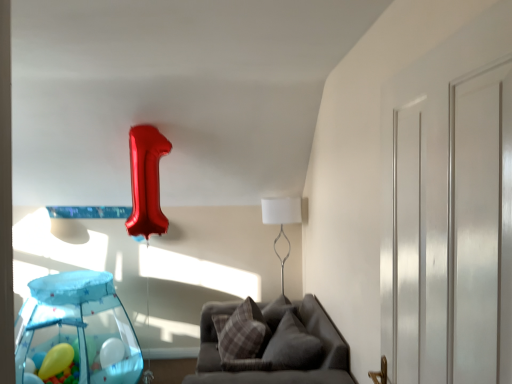
What are the coordinates of `white metallic table lamp at center` in the screenshot? It's located at (281, 222).

Measure the distance between gray fabric couch at lower center and camera.

The depth of gray fabric couch at lower center is 7.43 feet.

Describe the element at coordinates (56, 360) in the screenshot. I see `yellow rubber balloon at lower left` at that location.

What is the approximate width of plush gray pillow at center, acting as the first pillow starting from the right?

14.17 inches.

This screenshot has width=512, height=384. I want to click on white glossy door at right, so click(x=449, y=232).

This screenshot has width=512, height=384. What are the coordinates of `white metallic table lamp at center` in the screenshot? It's located at (281, 222).

Between gray fabric couch at lower center and white glossy door at right, which one has less height?

With less height is gray fabric couch at lower center.

This screenshot has width=512, height=384. I want to click on glass door that appears above the gray fabric couch at lower center (from a real-world perspective), so click(449, 232).

Does point (208, 365) lie in front of point (466, 147)?

No, it is not.

Which is correct: white metallic table lamp at center is inside white glossy door at right, or outside of it?

white metallic table lamp at center is spatially situated outside white glossy door at right.

From a real-world perspective, is white metallic table lamp at center located beneath white glossy door at right?

Correct, in the physical world, white metallic table lamp at center is lower than white glossy door at right.

Are white metallic table lamp at center and white glossy door at right far apart?

Yes.

Is white metallic table lamp at center taller than white glossy door at right?

No.

Between plaid fabric pillow at center, the 1th pillow from the left, and gray fabric couch at lower center, which one has larger size?

Bigger between the two is gray fabric couch at lower center.

From the gray fabric couch at lower center, count 2nd pillows backward and point to it. Please provide its 2D coordinates.

[(243, 333)]

Is plaid fabric pillow at center, the 1th pillow from the left, not within gray fabric couch at lower center?

No, most part of plaid fabric pillow at center, the 1th pillow from the left, lies within gray fabric couch at lower center.

Could you tell me if plaid fabric pillow at center, which appears as the second pillow when viewed from the right, is facing gray fabric couch at lower center?

Yes, plaid fabric pillow at center, which appears as the second pillow when viewed from the right, is facing gray fabric couch at lower center.

Could you tell me if yellow rubber balloon at lower left is facing gray fabric couch at lower center?

No, yellow rubber balloon at lower left is not facing towards gray fabric couch at lower center.

Does yellow rubber balloon at lower left have a greater height compared to gray fabric couch at lower center?

No.

Does yellow rubber balloon at lower left contain gray fabric couch at lower center?

No, gray fabric couch at lower center is not a part of yellow rubber balloon at lower left.

From the image's perspective, is yellow rubber balloon at lower left located beneath gray fabric couch at lower center?

Yes, from the image's perspective, yellow rubber balloon at lower left is below gray fabric couch at lower center.

Considering the relative sizes of white metallic table lamp at center and plush gray pillow at center, acting as the 2th pillow starting from the left, in the image provided, is white metallic table lamp at center smaller than plush gray pillow at center, acting as the 2th pillow starting from the left,?

Incorrect, white metallic table lamp at center is not smaller in size than plush gray pillow at center, acting as the 2th pillow starting from the left.

Consider the image. Is white metallic table lamp at center not close to plush gray pillow at center, acting as the 2th pillow starting from the left?

Yes, white metallic table lamp at center and plush gray pillow at center, acting as the 2th pillow starting from the left, are quite far apart.

From the image's perspective, is white metallic table lamp at center over plush gray pillow at center, acting as the 2th pillow starting from the left?

Correct, white metallic table lamp at center appears higher than plush gray pillow at center, acting as the 2th pillow starting from the left, in the image.

Which object is further away from the camera taking this photo, white metallic table lamp at center or plush gray pillow at center, acting as the first pillow starting from the right?

Positioned behind is white metallic table lamp at center.

From their relative heights in the image, would you say gray fabric couch at lower center is taller or shorter than yellow rubber balloon at lower left?

Clearly, gray fabric couch at lower center is taller compared to yellow rubber balloon at lower left.

Considering the positions of objects gray fabric couch at lower center and yellow rubber balloon at lower left in the image provided, who is more to the left, gray fabric couch at lower center or yellow rubber balloon at lower left?

yellow rubber balloon at lower left.

Would you say gray fabric couch at lower center contains yellow rubber balloon at lower left?

That's incorrect, yellow rubber balloon at lower left is not inside gray fabric couch at lower center.

How many degrees apart are the facing directions of gray fabric couch at lower center and yellow rubber balloon at lower left?

The facing directions of gray fabric couch at lower center and yellow rubber balloon at lower left are 93.8 degrees apart.

Does white metallic table lamp at center have a larger size compared to gray fabric couch at lower center?

No, white metallic table lamp at center is not bigger than gray fabric couch at lower center.

Can you confirm if white metallic table lamp at center is wider than gray fabric couch at lower center?

No.

From a real-world perspective, is white metallic table lamp at center on top of gray fabric couch at lower center?

Yes.

From the image's perspective, is white metallic table lamp at center beneath gray fabric couch at lower center?

No.

Find the location of `furniture directly beneath the white glossy door at right (from a real-world perspective)`. furniture directly beneath the white glossy door at right (from a real-world perspective) is located at coordinates (276, 371).

Find the location of a particular element. table lamp below the white glossy door at right (from the image's perspective) is located at coordinates (281, 222).

Looking at the image, which one is located further to yellow rubber balloon at lower left, translucent blue playpen at lower left or gray fabric couch at lower center?

Among the two, gray fabric couch at lower center is located further to yellow rubber balloon at lower left.

From the image, which object appears to be farther from gray fabric couch at lower center, white metallic table lamp at center or yellow rubber balloon at lower left?

yellow rubber balloon at lower left lies further to gray fabric couch at lower center than the other object.

Based on their spatial positions, is white glossy door at right or plaid fabric pillow at center, the 1th pillow from the left, further from white metallic table lamp at center?

Based on the image, white glossy door at right appears to be further to white metallic table lamp at center.

Which object lies further to the anchor point plush gray pillow at center, acting as the first pillow starting from the right, gray fabric couch at lower center or plaid fabric pillow at center, the 1th pillow from the left?

The object further to plush gray pillow at center, acting as the first pillow starting from the right, is plaid fabric pillow at center, the 1th pillow from the left.

Estimate the real-world distances between objects in this image. Which object is closer to plush gray pillow at center, acting as the 2th pillow starting from the left, yellow rubber balloon at lower left or white glossy door at right?

white glossy door at right.

Estimate the real-world distances between objects in this image. Which object is closer to plaid fabric pillow at center, the 1th pillow from the left, white metallic table lamp at center or gray fabric couch at lower center?

gray fabric couch at lower center.

Considering their positions, is plush gray pillow at center, acting as the 2th pillow starting from the left, positioned further to white metallic table lamp at center than plaid fabric pillow at center, the 1th pillow from the left?

plush gray pillow at center, acting as the 2th pillow starting from the left, lies further to white metallic table lamp at center than the other object.

Which object lies nearer to the anchor point plush gray pillow at center, acting as the 2th pillow starting from the left, white metallic table lamp at center or white glossy door at right?

Among the two, white metallic table lamp at center is located nearer to plush gray pillow at center, acting as the 2th pillow starting from the left.

I want to click on pillow between translucent blue playpen at lower left and gray fabric couch at lower center in the horizontal direction, so click(x=243, y=333).

Image resolution: width=512 pixels, height=384 pixels. In order to click on furniture between white glossy door at right and plaid fabric pillow at center, the 1th pillow from the left, from front to back in this screenshot , I will do `click(276, 371)`.

Where is `pillow between gray fabric couch at lower center and plaid fabric pillow at center, the 1th pillow from the left, from front to back`? The height and width of the screenshot is (384, 512). pillow between gray fabric couch at lower center and plaid fabric pillow at center, the 1th pillow from the left, from front to back is located at coordinates (293, 346).

Locate an element on the screen. glass table between white glossy door at right and yellow rubber balloon at lower left along the z-axis is located at coordinates (75, 332).